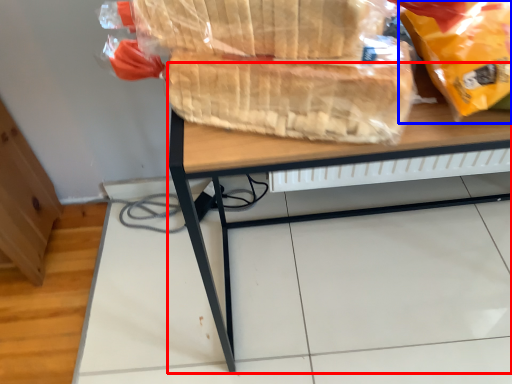
Question: Among these objects, which one is farthest to the camera, desk (highlighted by a red box) or plastic bag (highlighted by a blue box)?

Choices:
 (A) desk
 (B) plastic bag

Answer: (A)